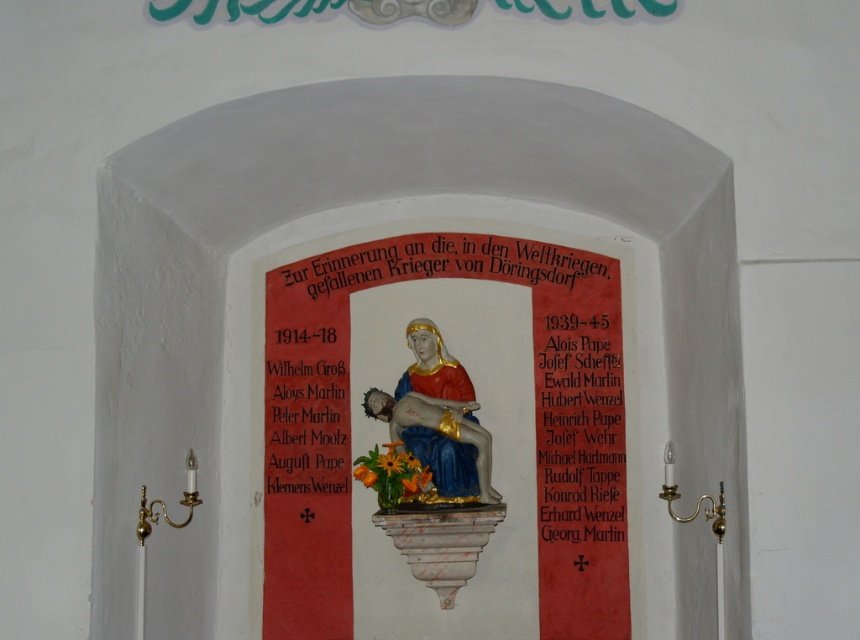
You are an interior designer planning to install a new lighting fixture in the niche. The lighting fixture will be placed above the gold metallic plaque at center. Based on the current arrangement, where should the lighting fixture be positioned relative to the black paper at right?

The lighting fixture should be positioned above the gold metallic plaque at center, which is located above the black paper at right. Therefore, the lighting fixture will be placed above both the gold metallic plaque at center and the black paper at right.

You are an interior designer planning to place a new decorative item in the church niche. The niche has a central statue of a woman holding a child. You have a small black paper decoration that you want to position at the same coordinates as the existing black paper at right. What are the coordinates where you should place your new decoration?

You should place your new decoration at coordinates point (579, 428), as this is where the existing black paper at right is located.